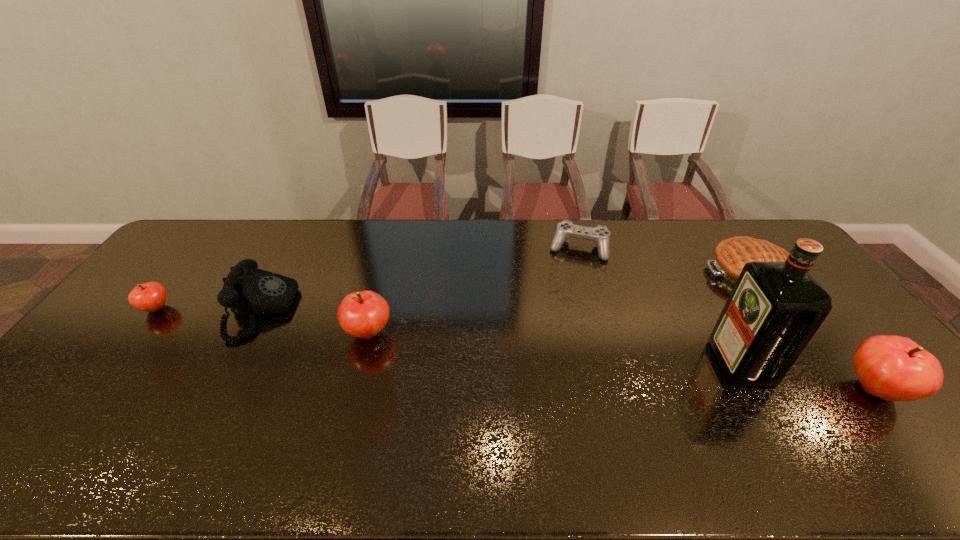
The width and height of the screenshot is (960, 540). I want to click on free space between the liquor and the fifth object from right to left, so click(x=555, y=348).

This screenshot has height=540, width=960. Find the location of `free space between the leftmost apple and the tallest object`. free space between the leftmost apple and the tallest object is located at coordinates (448, 336).

Where is `unoccupied area between the fourth object from right to left and the pie`? The width and height of the screenshot is (960, 540). unoccupied area between the fourth object from right to left and the pie is located at coordinates (663, 260).

Point out which object is positioned as the nearest to the nearest apple. Please provide its 2D coordinates. Your answer should be formatted as a tuple, i.e. [(x, y)], where the tuple contains the x and y coordinates of a point satisfying the conditions above.

[(775, 308)]

What are the coordinates of `object that is the closest to the nearest apple` in the screenshot? It's located at (775, 308).

Select which apple is the second closest to the nearest apple. Please provide its 2D coordinates. Your answer should be formatted as a tuple, i.e. [(x, y)], where the tuple contains the x and y coordinates of a point satisfying the conditions above.

[(151, 296)]

Identify which apple is the second nearest to the telephone. Please provide its 2D coordinates. Your answer should be formatted as a tuple, i.e. [(x, y)], where the tuple contains the x and y coordinates of a point satisfying the conditions above.

[(151, 296)]

Identify the location of blank area in the image that satisfies the following two spatial constraints: 1. on the front side of the control; 2. on the left side of the rightmost apple. The image size is (960, 540). (617, 389).